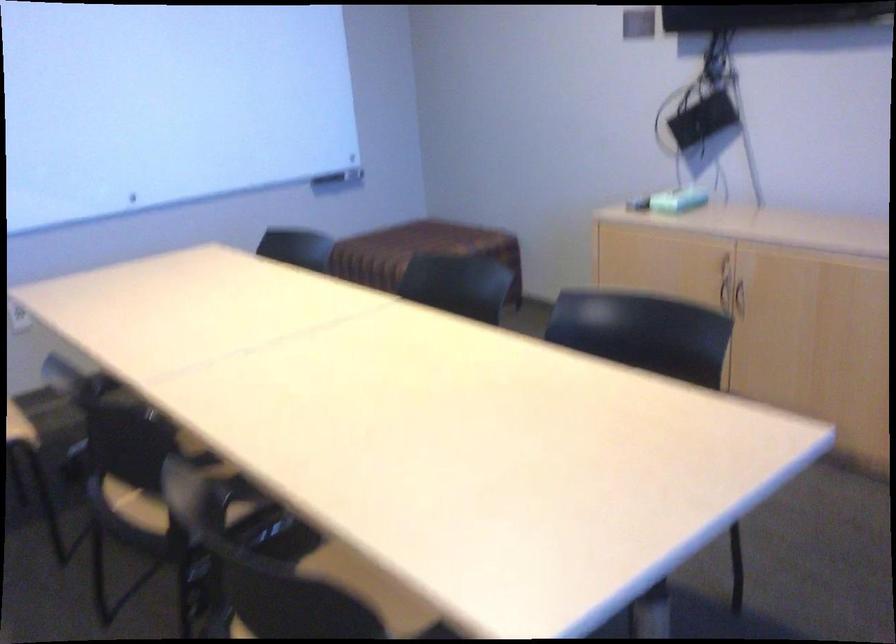
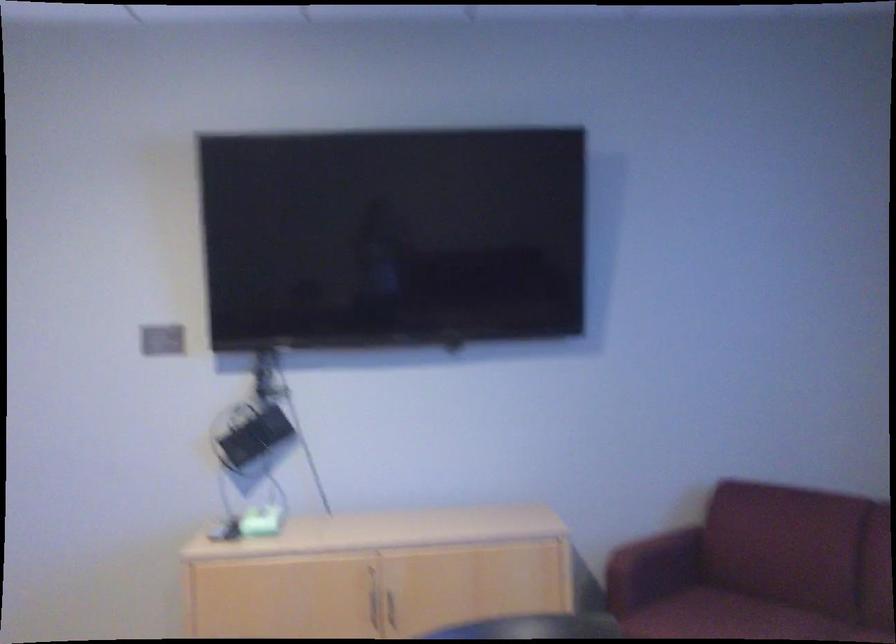
In the second image, find the point that corresponds to point 755,295 in the first image.

(392, 607)